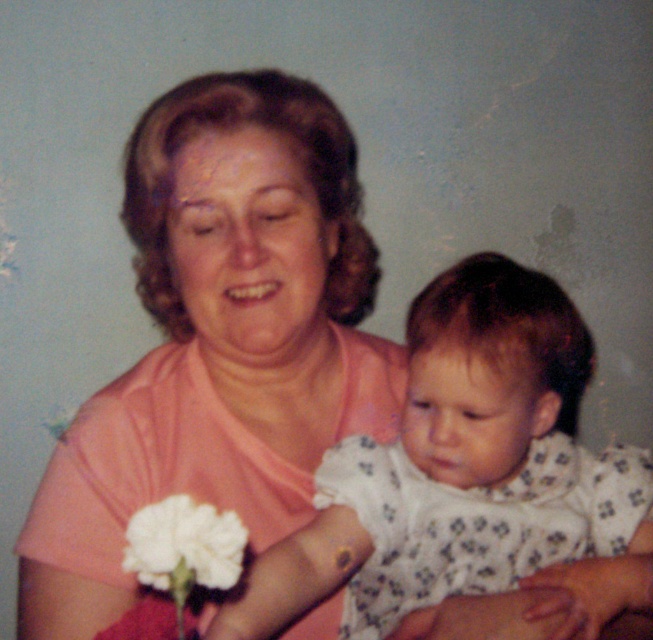
The image size is (653, 640). Identify the location of white dotted dress at center. (488, 369).

Is point (575, 396) closer to viewer compared to point (200, 563)?

No, (575, 396) is behind (200, 563).

Find the location of a particular element. Image resolution: width=653 pixels, height=640 pixels. white dotted dress at center is located at coordinates (488, 369).